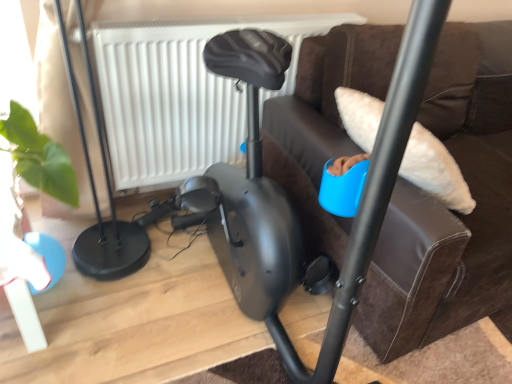
Question: From a real-world perspective, is white textured radiator at upper center physically above black matte exercise bike at center?

Choices:
 (A) yes
 (B) no

Answer: (B)

Question: Is the depth of white textured radiator at upper center greater than that of black matte exercise bike at center?

Choices:
 (A) no
 (B) yes

Answer: (B)

Question: From a real-world perspective, does white textured radiator at upper center sit lower than black matte exercise bike at center?

Choices:
 (A) no
 (B) yes

Answer: (B)

Question: Does white textured radiator at upper center have a lesser width compared to black matte exercise bike at center?

Choices:
 (A) no
 (B) yes

Answer: (B)

Question: Can you confirm if white textured radiator at upper center is bigger than black matte exercise bike at center?

Choices:
 (A) yes
 (B) no

Answer: (B)

Question: Is white textured radiator at upper center far from black matte exercise bike at center?

Choices:
 (A) yes
 (B) no

Answer: (B)

Question: Is black matte exercise bike at center wider than white textured radiator at upper center?

Choices:
 (A) no
 (B) yes

Answer: (B)

Question: Considering the relative sizes of black matte exercise bike at center and white textured radiator at upper center in the image provided, is black matte exercise bike at center bigger than white textured radiator at upper center?

Choices:
 (A) no
 (B) yes

Answer: (B)

Question: Is black matte exercise bike at center thinner than white textured radiator at upper center?

Choices:
 (A) no
 (B) yes

Answer: (A)

Question: Can you confirm if black matte exercise bike at center is shorter than white textured radiator at upper center?

Choices:
 (A) no
 (B) yes

Answer: (A)

Question: Could you tell me if black matte exercise bike at center is turned towards white textured radiator at upper center?

Choices:
 (A) no
 (B) yes

Answer: (A)

Question: From a real-world perspective, is black matte exercise bike at center located beneath white textured radiator at upper center?

Choices:
 (A) no
 (B) yes

Answer: (A)

Question: Considering the positions of black matte exercise bike at center and white textured radiator at upper center in the image, is black matte exercise bike at center wider or thinner than white textured radiator at upper center?

Choices:
 (A) wide
 (B) thin

Answer: (A)